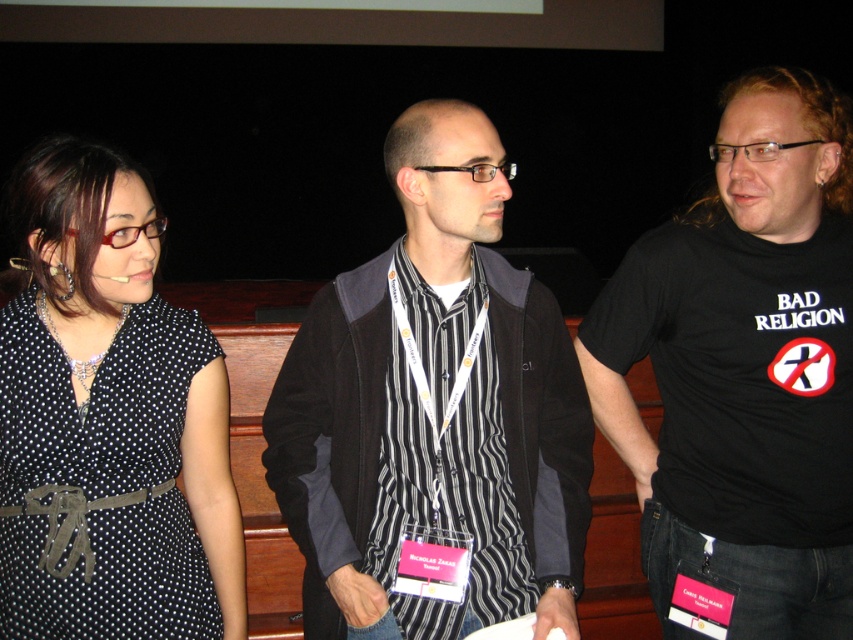
Who is shorter, striped fabric shirt at center or black striped shirt at center?

With less height is black striped shirt at center.

Is point (310, 616) positioned before point (508, 506)?

That is False.

Between point (415, 128) and point (453, 371), which one is positioned behind?

The point (453, 371) is behind.

Identify the location of striped fabric shirt at center. This screenshot has width=853, height=640. (434, 406).

Does point (735, 272) come behind point (392, 531)?

Yes.

Can you confirm if black t-shirt at right is bigger than black striped shirt at center?

Correct, black t-shirt at right is larger in size than black striped shirt at center.

Locate an element on the screen. The image size is (853, 640). black t-shirt at right is located at coordinates (744, 374).

Which is more to the right, polka dot fabric dress at left or black striped shirt at center?

From the viewer's perspective, black striped shirt at center appears more on the right side.

Is polka dot fabric dress at left to the right of black striped shirt at center from the viewer's perspective?

No, polka dot fabric dress at left is not to the right of black striped shirt at center.

Is point (175, 328) farther from viewer compared to point (450, 515)?

No, it is not.

At what (x,y) coordinates should I click in order to perform the action: click on polka dot fabric dress at left. Please return your answer as a coordinate pair (x, y). The height and width of the screenshot is (640, 853). Looking at the image, I should click on (107, 419).